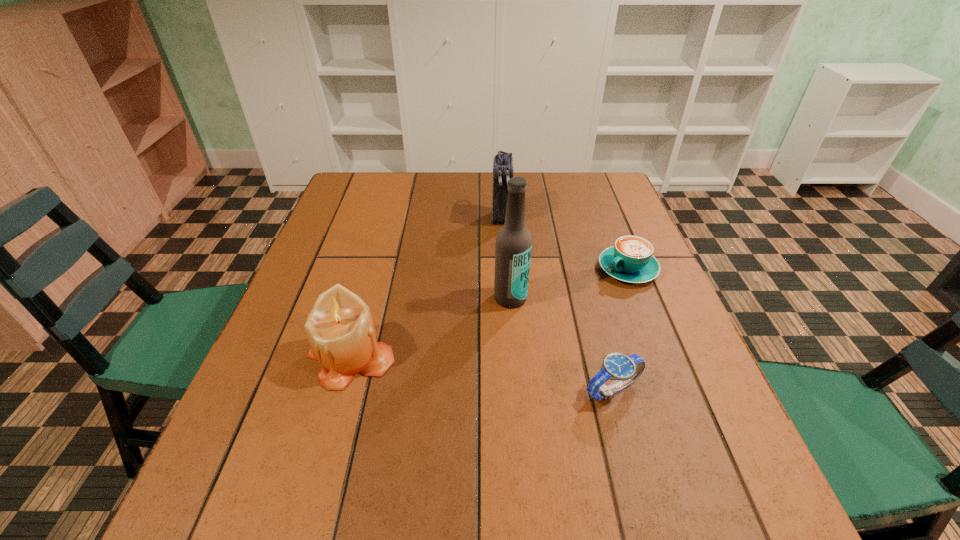
Locate an element on the screen. This screenshot has width=960, height=540. free location located 0.310m with the zip open on the farthest object is located at coordinates (500, 305).

Where is `free space located 0.210m on the label of the beer bottle`? This screenshot has height=540, width=960. free space located 0.210m on the label of the beer bottle is located at coordinates (516, 386).

This screenshot has height=540, width=960. Find the location of `free space located 0.260m on the label of the beer bottle`. free space located 0.260m on the label of the beer bottle is located at coordinates (518, 408).

Find the location of `vacant space located on the label of the beer bottle`. vacant space located on the label of the beer bottle is located at coordinates (513, 329).

Identify the location of free space located 0.190m with the handle on the right side of the cappuccino. Image resolution: width=960 pixels, height=540 pixels. (554, 315).

At what (x,y) coordinates should I click in order to perform the action: click on free space located with the handle on the right side of the cappuccino. Please return your answer as a coordinate pair (x, y). This screenshot has height=540, width=960. Looking at the image, I should click on (561, 311).

I want to click on free space located with the handle on the right side of the cappuccino, so (x=504, y=346).

Identify the location of object that is at the far edge. (503, 164).

Locate an element on the screen. object at the left edge is located at coordinates (342, 336).

Find the location of a particular element. watch that is positioned at the right edge is located at coordinates (625, 369).